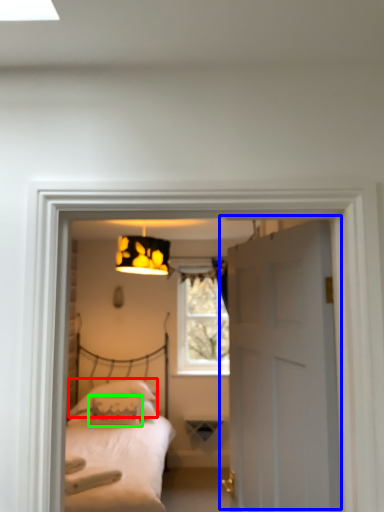
Question: Which object is the closest to the pillow (highlighted by a red box)? Choose among these: door (highlighted by a blue box) or pillow (highlighted by a green box).

Choices:
 (A) door
 (B) pillow

Answer: (B)